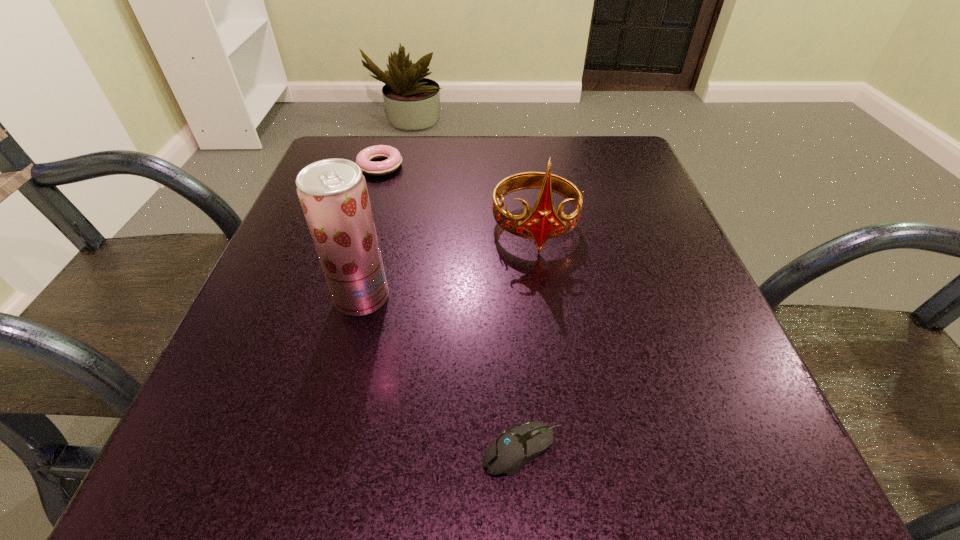
Identify the location of object present at the far edge. The width and height of the screenshot is (960, 540). (364, 159).

The image size is (960, 540). In order to click on object present at the near edge in this screenshot , I will do `click(515, 447)`.

This screenshot has height=540, width=960. I want to click on fruit juice situated at the left edge, so coord(333,193).

The height and width of the screenshot is (540, 960). I want to click on doughnut that is positioned at the left edge, so click(364, 159).

Where is `object situated at the far left corner`? The height and width of the screenshot is (540, 960). object situated at the far left corner is located at coordinates (364, 159).

In the image, there is a desktop. Identify the location of vacant space at the far edge. This screenshot has width=960, height=540. (522, 156).

Locate an element on the screen. This screenshot has height=540, width=960. vacant space at the left edge is located at coordinates (x=219, y=385).

In the image, there is a desktop. Where is `vacant space at the right edge`? The width and height of the screenshot is (960, 540). vacant space at the right edge is located at coordinates (636, 270).

In the image, there is a desktop. At what (x,y) coordinates should I click in order to perform the action: click on vacant region at the far left corner. Please return your answer as a coordinate pair (x, y). Looking at the image, I should click on (368, 188).

I want to click on vacant area that lies between the tiara and the nearest object, so pos(529,339).